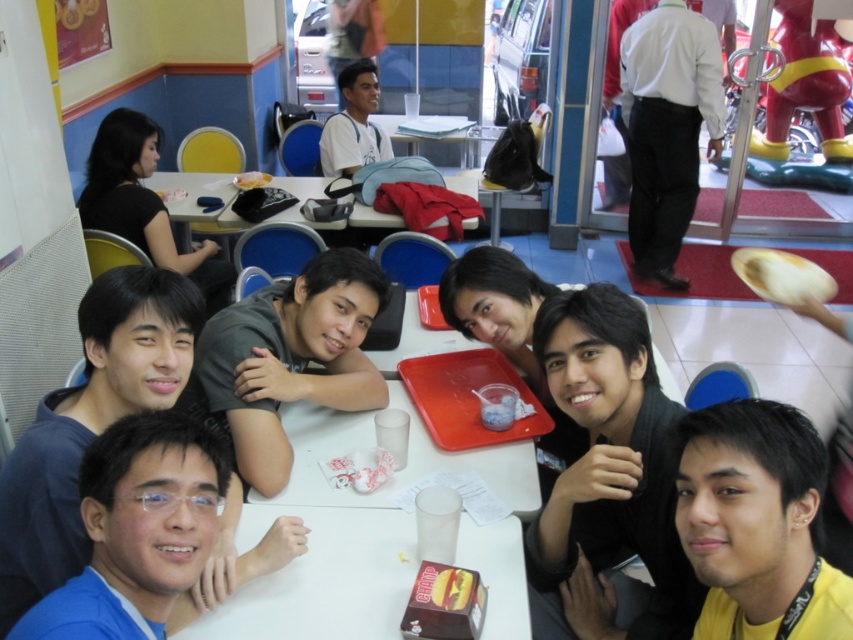
Question: Is blue matte shirt at center wider than yellow matte hot dog at center?

Choices:
 (A) no
 (B) yes

Answer: (B)

Question: Which of the following is the closest to the observer?

Choices:
 (A) (447, 588)
 (B) (242, 532)

Answer: (A)

Question: Among these objects, which one is nearest to the camera?

Choices:
 (A) matte black phone at upper center
 (B) black matte shirt at upper left

Answer: (B)

Question: Is white plastic table at lower center thinner than white smooth shirt at upper right?

Choices:
 (A) no
 (B) yes

Answer: (A)

Question: Among these points, which one is farthest from the camera?

Choices:
 (A) 714,132
 (B) 500,602
 (C) 402,220

Answer: (A)

Question: Where is blue matte shirt at lower left located in relation to yellow matte hot dog at center in the image?

Choices:
 (A) above
 (B) below

Answer: (A)